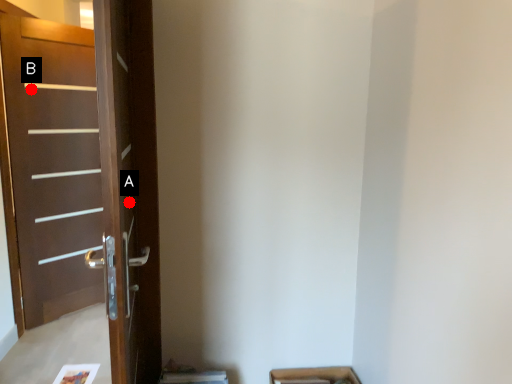
Question: Two points are circled on the image, labeled by A and B beside each circle. Among these points, which one is nearest to the camera?

Choices:
 (A) A is closer
 (B) B is closer

Answer: (A)